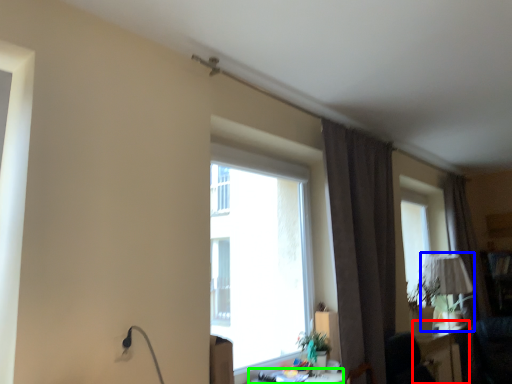
Question: Which is nearer to the table (highlighted by a red box)? table lamp (highlighted by a blue box) or table (highlighted by a green box).

Choices:
 (A) table lamp
 (B) table

Answer: (A)